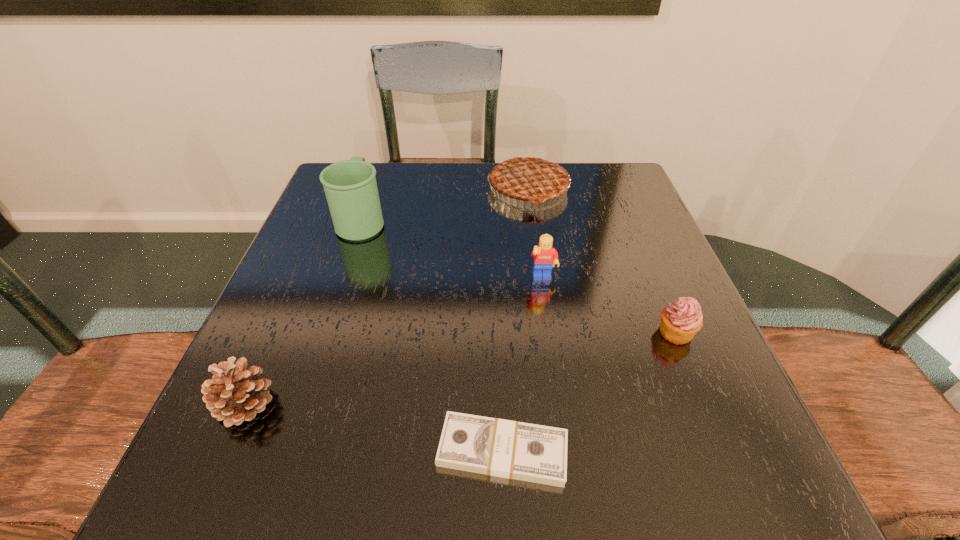
Locate an element on the screen. vacant space that is in between the Lego and the pinecone is located at coordinates (395, 342).

Identify the location of unoccupied position between the third farthest object and the pie. (536, 234).

Locate an element on the screen. empty space that is in between the fourth farthest object and the dollar is located at coordinates (589, 391).

What are the coordinates of `free space that is in between the pie and the fifth tallest object` in the screenshot? It's located at (602, 260).

You are a GUI agent. You are given a task and a screenshot of the screen. Output one action in this format:
    pyautogui.click(x=<x>, y=<y>)
    Task: Click on the free area in between the third farthest object and the shortest object
    This screenshot has width=960, height=540.
    Given the screenshot: What is the action you would take?
    pyautogui.click(x=522, y=365)

Find the location of a particular element. The width and height of the screenshot is (960, 540). free space between the shortest object and the pie is located at coordinates (516, 320).

Locate an element on the screen. Image resolution: width=960 pixels, height=540 pixels. free space between the mug and the pinecone is located at coordinates click(x=304, y=312).

Identify the location of vacant area between the pie and the Lego. (536, 234).

Locate an element on the screen. free space between the dollar and the pie is located at coordinates (516, 320).

Image resolution: width=960 pixels, height=540 pixels. In order to click on free spot between the third farthest object and the shortest object in this screenshot , I will do `click(522, 365)`.